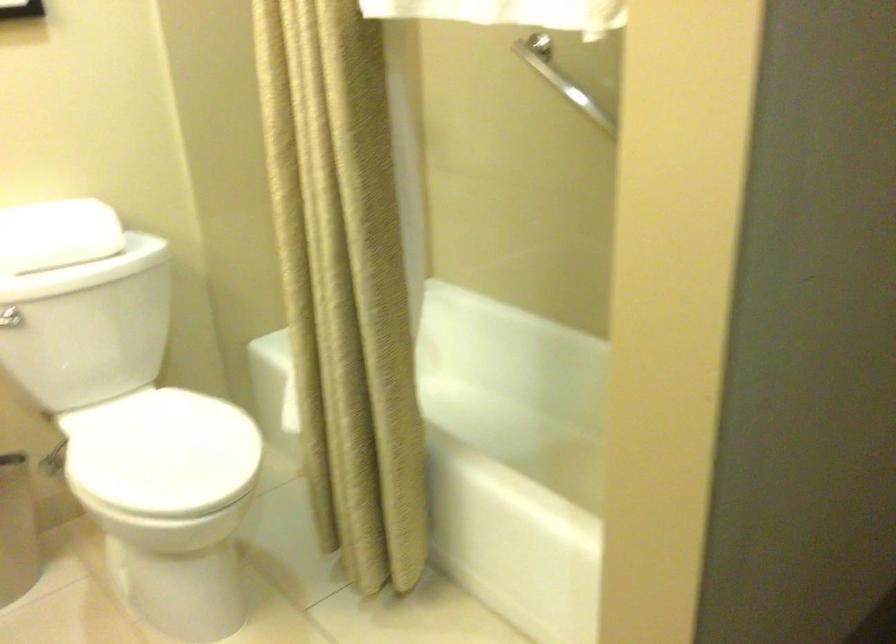
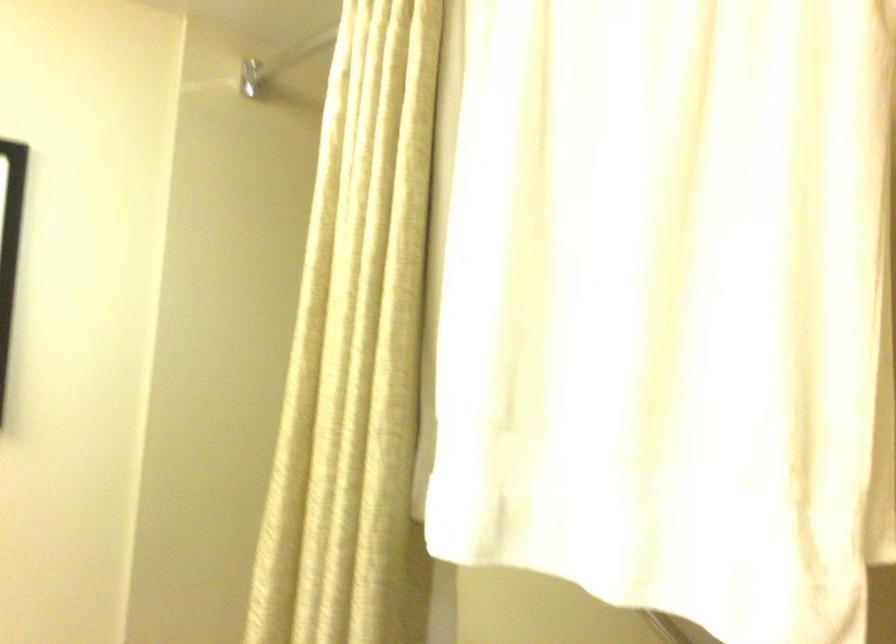
Question: How did the camera likely rotate?

Choices:
 (A) Left
 (B) Right
 (C) Up
 (D) Down

Answer: (C)